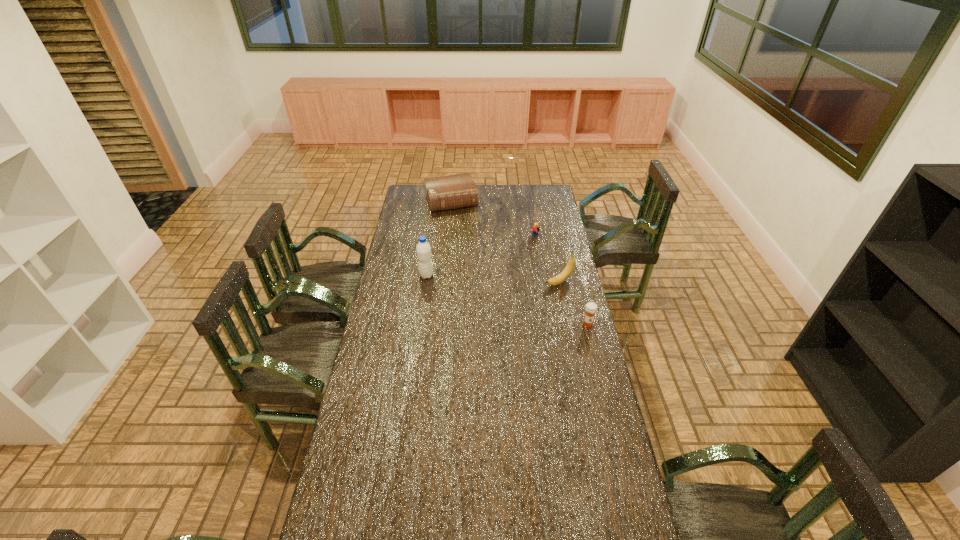
What are the coordinates of `Lego located at the right edge` in the screenshot? It's located at (535, 229).

Identify the location of banana situated at the right edge. (567, 271).

Identify the location of object at the far left corner. (450, 192).

Identify the location of vacant space at the far edge of the desktop. (513, 190).

Find the location of a particular element. Image resolution: width=960 pixels, height=540 pixels. free space at the left edge is located at coordinates (389, 284).

Image resolution: width=960 pixels, height=540 pixels. Find the location of `free location at the right edge`. free location at the right edge is located at coordinates (566, 388).

Find the location of a particular element. This screenshot has height=540, width=960. free space between the second tallest object and the Lego is located at coordinates (547, 260).

Where is `unoccupied position between the tallest object and the Bible`? This screenshot has height=540, width=960. unoccupied position between the tallest object and the Bible is located at coordinates (439, 239).

The image size is (960, 540). Identify the location of vacant point located between the Lego and the fourth shortest object. (547, 260).

Locate an element on the screen. The image size is (960, 540). blank region between the banana and the tallest object is located at coordinates (492, 279).